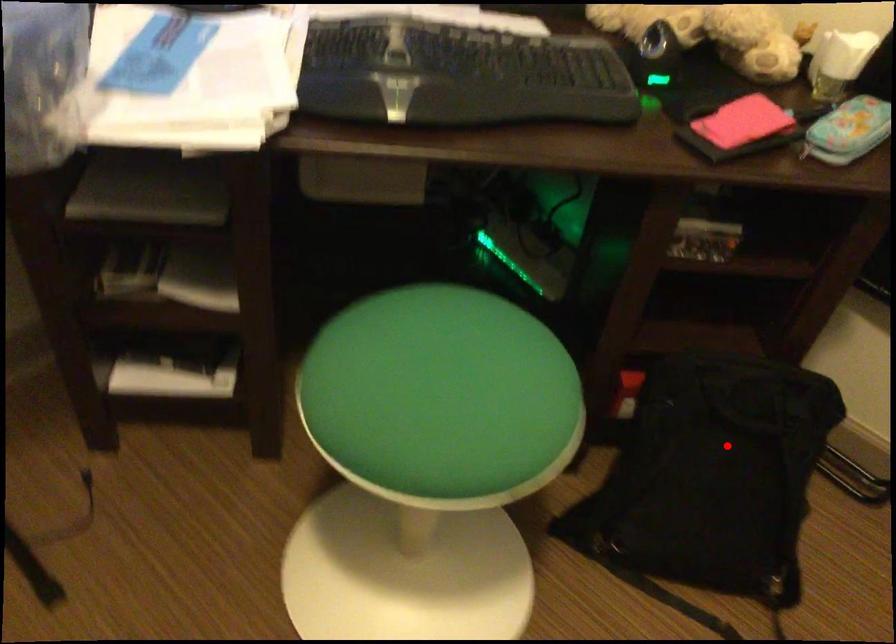
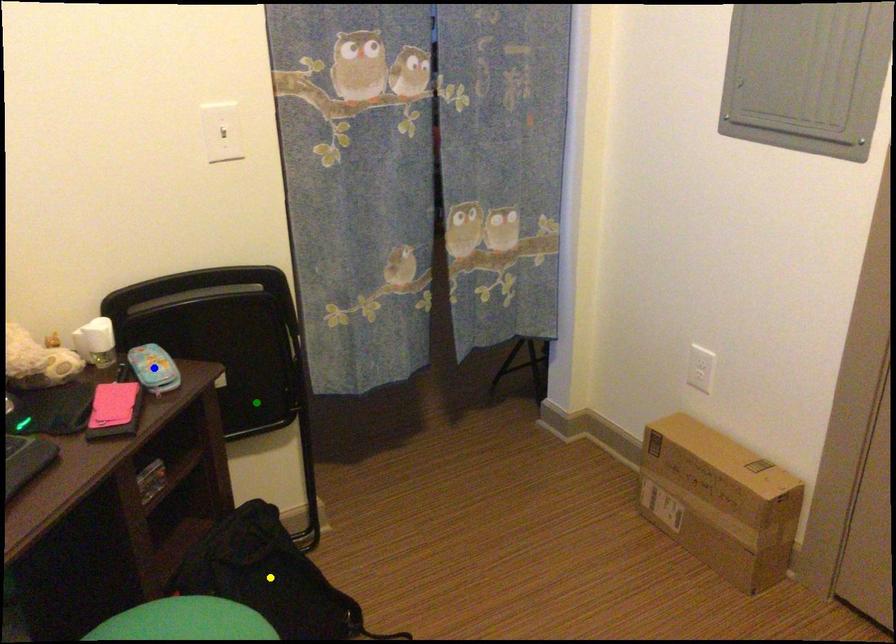
Question: I am providing you with two images of the same scene from different viewpoints. A red point is marked on the first image. You are given multiple points on the second image. Which spot in image 2 lines up with the point in image 1?

Choices:
 (A) green point
 (B) yellow point
 (C) blue point

Answer: (B)